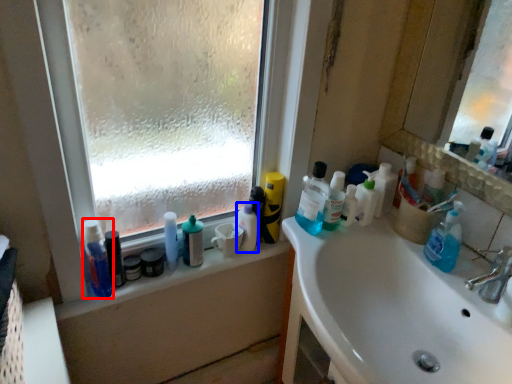
Question: Which point is further to the camera, toiletry (highlighted by a red box) or toiletry (highlighted by a blue box)?

Choices:
 (A) toiletry
 (B) toiletry

Answer: (B)